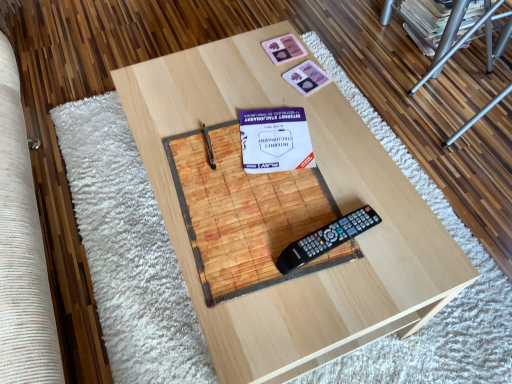
What are the coordinates of `unoccupied region to the right of white paper at center` in the screenshot? It's located at click(x=345, y=146).